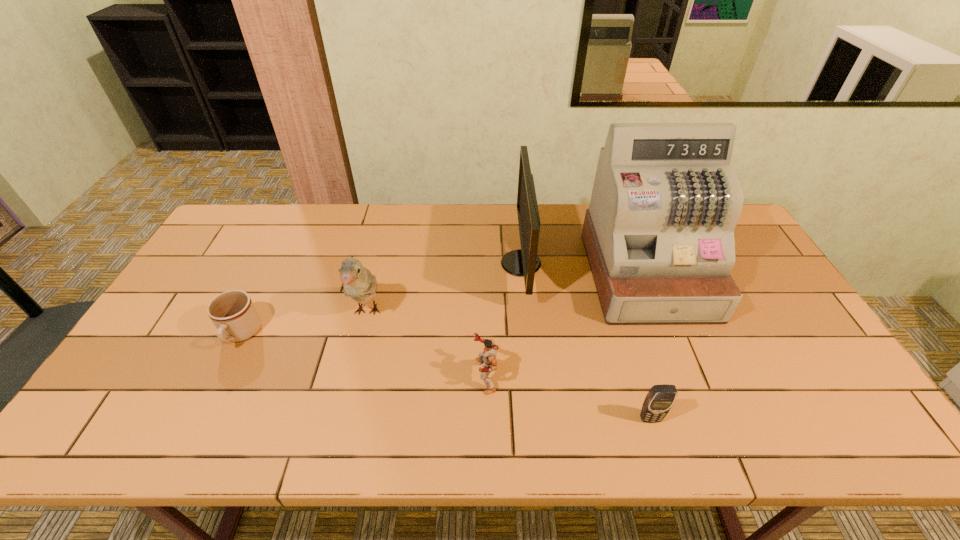
Locate an element on the screen. free space located on the operating side of the cash register is located at coordinates (695, 396).

You are a GUI agent. You are given a task and a screenshot of the screen. Output one action in this format:
    pyautogui.click(x=<x>, y=<y>)
    Task: Click on the vacant region located on the front-facing side of the second tallest object
    
    Given the screenshot: What is the action you would take?
    381,264

The height and width of the screenshot is (540, 960). Identify the location of free location located on the front-facing side of the second tallest object. (469, 264).

I want to click on vacant region located 0.210m on the front-facing side of the second tallest object, so click(x=435, y=264).

The width and height of the screenshot is (960, 540). What are the coordinates of `vacant region located at the face of the bird` in the screenshot? It's located at (356, 358).

This screenshot has height=540, width=960. I want to click on free space located 0.190m on the front-facing side of the puncher, so click(397, 376).

This screenshot has height=540, width=960. In order to click on vacant space located on the front-facing side of the puncher in this screenshot , I will do `click(365, 376)`.

What are the coordinates of `free point located on the front-facing side of the puncher` in the screenshot? It's located at pyautogui.click(x=413, y=376).

Identify the location of vacant position located on the side of the shortest object with the handle. (211, 393).

Locate an element on the screen. This screenshot has width=960, height=540. cash register present at the far edge is located at coordinates (659, 233).